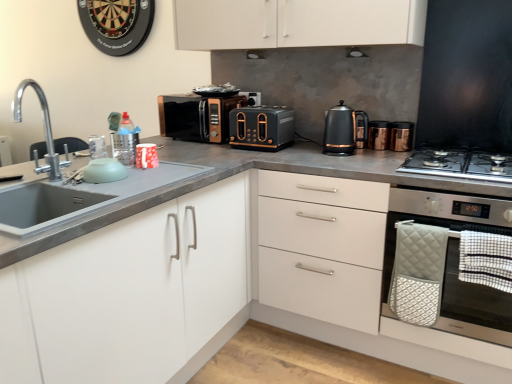
The height and width of the screenshot is (384, 512). I want to click on free space in front of gold metallic canister at upper right, which ranks as the 3th appliance in back-to-front order, so click(400, 150).